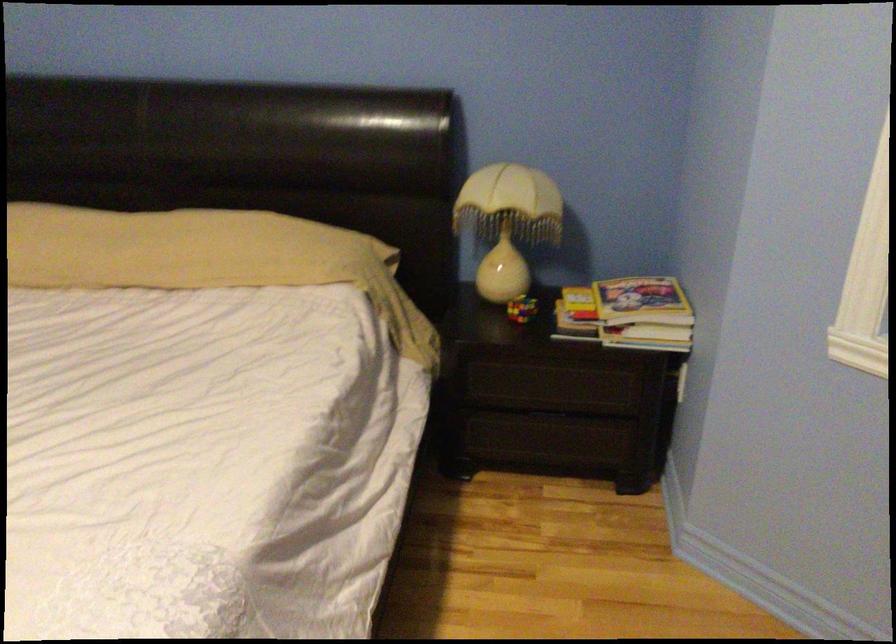
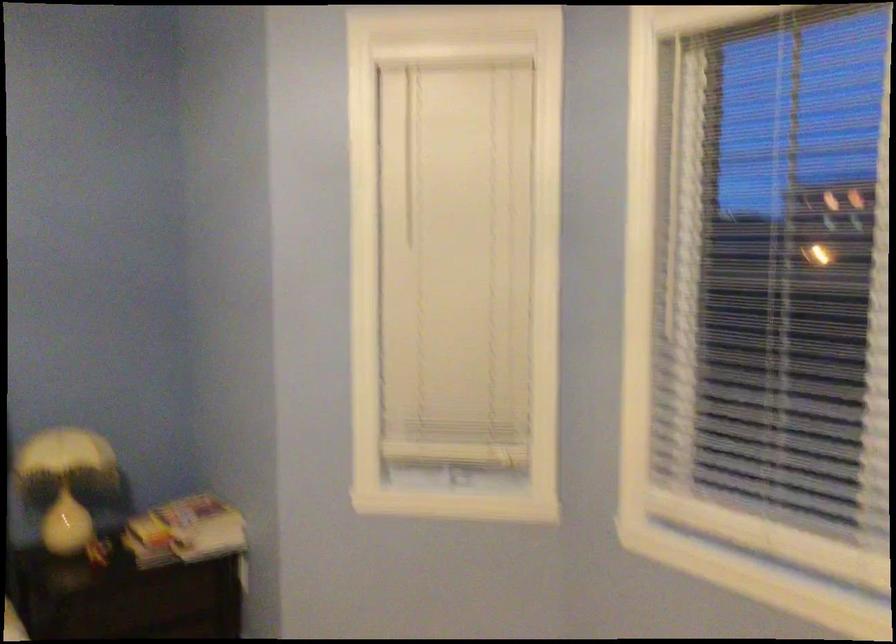
Locate, in the second image, the point that corresponds to the point at 609,316 in the first image.

(185, 532)